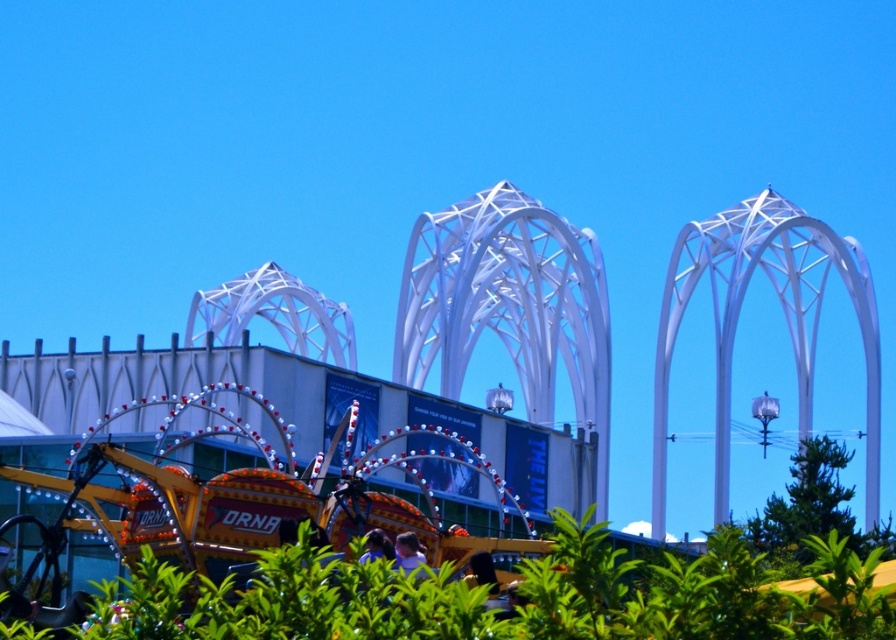
You are standing at the camera position looking at the point marked at coordinates point [256,632]. If you walk straight towards it, how far will you have to walk to reach it?

You will have to walk 47.60 meters to reach the point [256,632] because it is 47.60 meters away from the camera.

You are planning to set up a new attraction next to the metallic amusement ride at center and the metallic yellow amusement ride at lower left. Considering their widths, which one should you place your new attraction closer to if you want to maximize space efficiency?

The metallic amusement ride at center might be wider than metallic yellow amusement ride at lower left, so placing the new attraction closer to the metallic yellow amusement ride at lower left would allow for better space efficiency since it is narrower.

You are standing in the outdoor scene and want to take a photo of both the metallic amusement ride at center and the metallic yellow amusement ride at lower left. Which one should you focus on first to ensure both are in the frame?

You should focus on the metallic amusement ride at center first because it is closer to the viewer, so adjusting the camera to include it will naturally bring the metallic yellow amusement ride at lower left into the frame as well.